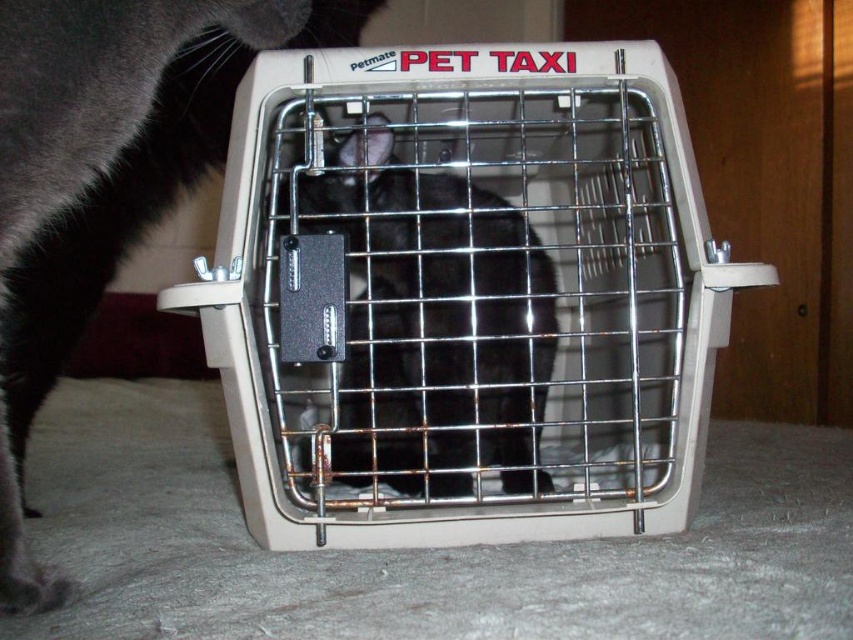
Question: Can you confirm if black fur cat at center is positioned above black matte fur cat at center?

Choices:
 (A) yes
 (B) no

Answer: (A)

Question: Which point is closer to the camera?

Choices:
 (A) (16, 454)
 (B) (473, 234)
 (C) (415, 467)

Answer: (B)

Question: Which of the following is the closest to the observer?

Choices:
 (A) black fur cat at center
 (B) black matte fur cat at center
 (C) beige plastic pet taxi at center

Answer: (A)

Question: Can you confirm if beige plastic pet taxi at center is thinner than black matte fur cat at center?

Choices:
 (A) yes
 (B) no

Answer: (B)

Question: Does beige plastic pet taxi at center appear under black fur cat at center?

Choices:
 (A) yes
 (B) no

Answer: (A)

Question: Estimate the real-world distances between objects in this image. Which object is farther from the black fur cat at center?

Choices:
 (A) black matte fur cat at center
 (B) beige plastic pet taxi at center

Answer: (B)